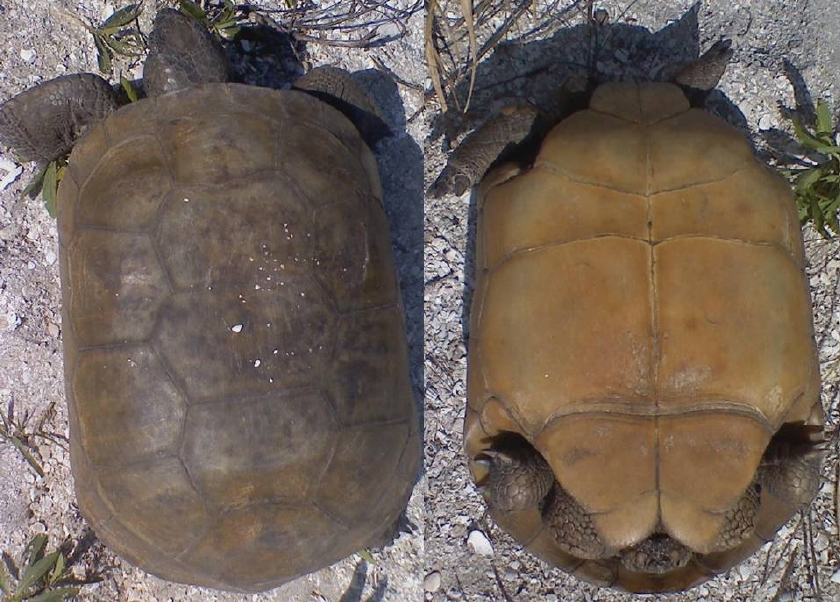
You are a GUI agent. You are given a task and a screenshot of the screen. Output one action in this format:
    pyautogui.click(x=<x>, y=<y>)
    Task: Click on the scales
    This screenshot has height=602, width=840.
    Given the screenshot: What is the action you would take?
    pyautogui.click(x=180, y=59), pyautogui.click(x=64, y=102), pyautogui.click(x=343, y=85), pyautogui.click(x=505, y=123), pyautogui.click(x=711, y=82), pyautogui.click(x=520, y=461), pyautogui.click(x=565, y=523), pyautogui.click(x=655, y=544), pyautogui.click(x=749, y=526)